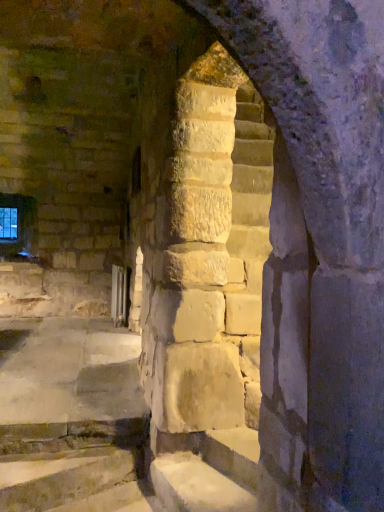
Image resolution: width=384 pixels, height=512 pixels. I want to click on transparent glass window at upper left, so click(8, 223).

What is the approximate width of transparent glass window at upper left?

It is 3.15 inches.

The height and width of the screenshot is (512, 384). What do you see at coordinates (8, 223) in the screenshot?
I see `transparent glass window at upper left` at bounding box center [8, 223].

Where is `smooth stone stairs at center`? smooth stone stairs at center is located at coordinates (206, 470).

What do you see at coordinates (206, 470) in the screenshot? I see `smooth stone stairs at center` at bounding box center [206, 470].

Image resolution: width=384 pixels, height=512 pixels. Identify the location of transparent glass window at upper left. (8, 223).

Can you confirm if transparent glass window at upper left is positioned to the left of smooth stone stairs at center?

Yes.

Is transparent glass window at upper left positioned before smooth stone stairs at center?

No.

Considering the positions of points (12, 236) and (243, 434), is point (12, 236) closer to camera compared to point (243, 434)?

No, (12, 236) is behind (243, 434).

From the image's perspective, does transparent glass window at upper left appear higher than smooth stone stairs at center?

Yes, from the image's perspective, transparent glass window at upper left is above smooth stone stairs at center.

Based on the photo, from a real-world perspective, is transparent glass window at upper left physically above smooth stone stairs at center?

Yes, from a real-world perspective, transparent glass window at upper left is on top of smooth stone stairs at center.

Which of these two, transparent glass window at upper left or smooth stone stairs at center, is wider?

Wider between the two is smooth stone stairs at center.

From their relative heights in the image, would you say transparent glass window at upper left is taller or shorter than smooth stone stairs at center?

Clearly, transparent glass window at upper left is taller compared to smooth stone stairs at center.

Does transparent glass window at upper left have a smaller size compared to smooth stone stairs at center?

Correct, transparent glass window at upper left occupies less space than smooth stone stairs at center.

Can we say transparent glass window at upper left lies outside smooth stone stairs at center?

Absolutely, transparent glass window at upper left is external to smooth stone stairs at center.

Is transparent glass window at upper left far away from smooth stone stairs at center?

Yes, transparent glass window at upper left is far from smooth stone stairs at center.

Is transparent glass window at upper left positioned with its back to smooth stone stairs at center?

No, transparent glass window at upper left is not facing away from smooth stone stairs at center.

The height and width of the screenshot is (512, 384). I want to click on stairwell on the right of transparent glass window at upper left, so click(206, 470).

Is smooth stone stairs at center to the left or to the right of transparent glass window at upper left in the image?

Clearly, smooth stone stairs at center is on the right of transparent glass window at upper left in the image.

Which object is further away from the camera, smooth stone stairs at center or transparent glass window at upper left?

transparent glass window at upper left is further away from the camera.

Does point (184, 495) appear closer or farther from the camera than point (7, 208)?

Clearly, point (184, 495) is closer to the camera than point (7, 208).

From the image's perspective, is smooth stone stairs at center located above or below transparent glass window at upper left?

Clearly, from the image's perspective, smooth stone stairs at center is below transparent glass window at upper left.

From a real-world perspective, which is physically above, smooth stone stairs at center or transparent glass window at upper left?

In real-world perspective, transparent glass window at upper left is above.

In the scene shown: Which of these two, smooth stone stairs at center or transparent glass window at upper left, is wider?

Wider between the two is smooth stone stairs at center.

Can you confirm if smooth stone stairs at center is taller than transparent glass window at upper left?

No.

Between smooth stone stairs at center and transparent glass window at upper left, which one has larger size?

smooth stone stairs at center.

Is smooth stone stairs at center surrounding transparent glass window at upper left?

Definitely not — transparent glass window at upper left is not inside smooth stone stairs at center.

Is smooth stone stairs at center far from transparent glass window at upper left?

That's right, there is a large distance between smooth stone stairs at center and transparent glass window at upper left.

Is smooth stone stairs at center facing away from transparent glass window at upper left?

No, smooth stone stairs at center is not facing away from transparent glass window at upper left.

How different are the orientations of smooth stone stairs at center and transparent glass window at upper left in degrees?

smooth stone stairs at center and transparent glass window at upper left are facing 72.9 degrees away from each other.

Where is `glass window to the left of smooth stone stairs at center`? This screenshot has width=384, height=512. glass window to the left of smooth stone stairs at center is located at coordinates (8, 223).

Find the location of a particular element. The height and width of the screenshot is (512, 384). glass window behind the smooth stone stairs at center is located at coordinates (8, 223).

Identify the location of stairwell on the right of transparent glass window at upper left. The width and height of the screenshot is (384, 512). (206, 470).